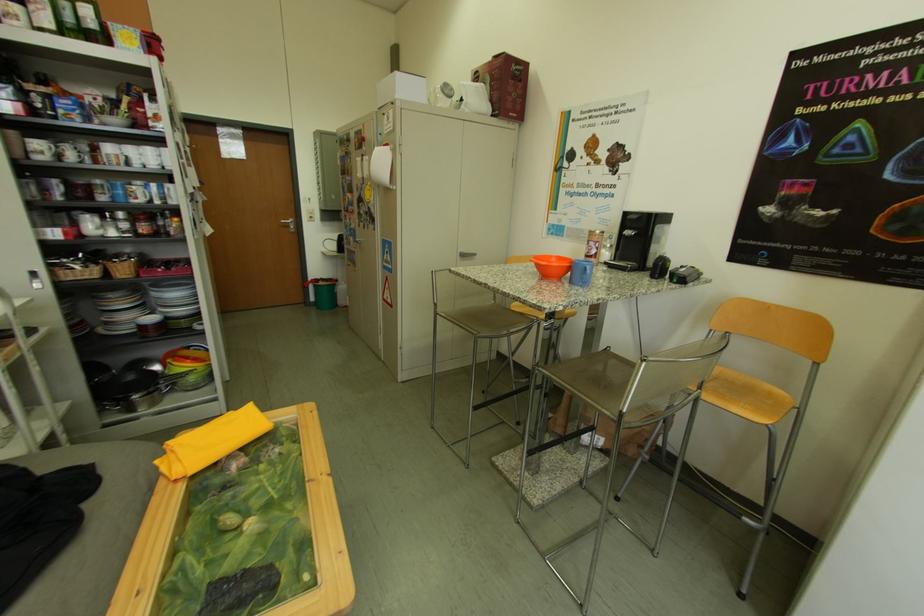
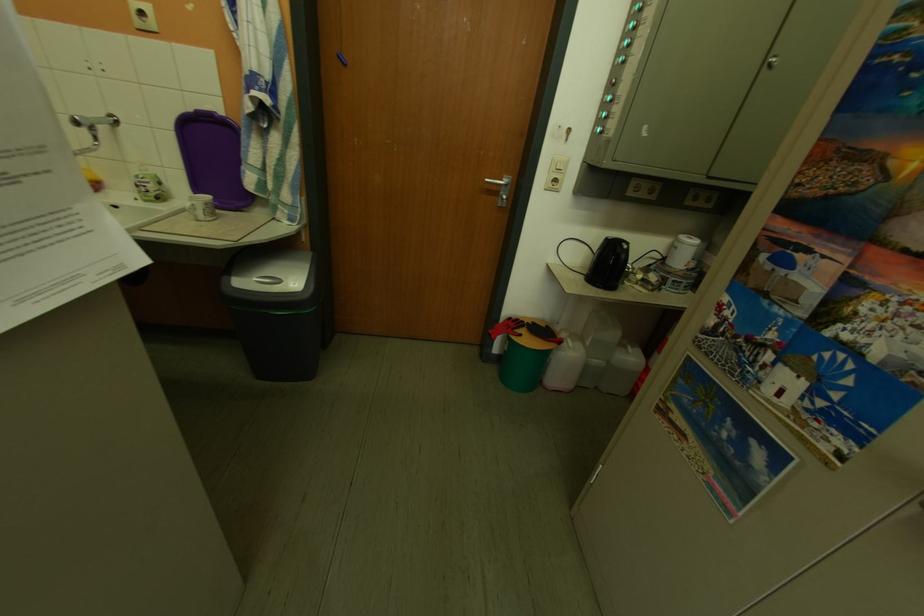
Find the pixel in the second image that matches point 332,285 in the first image.

(533, 338)